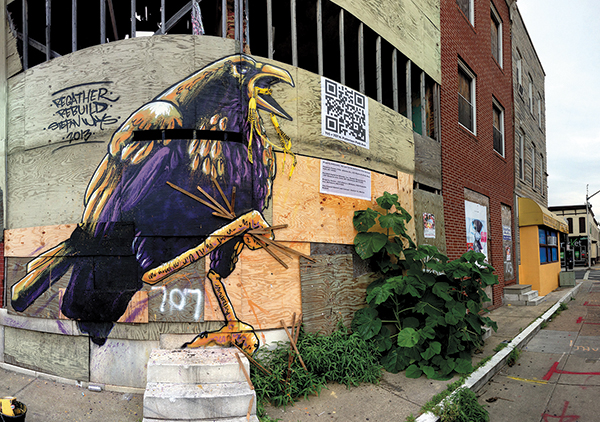
Locate an element on the screen. windows is located at coordinates (471, 102).